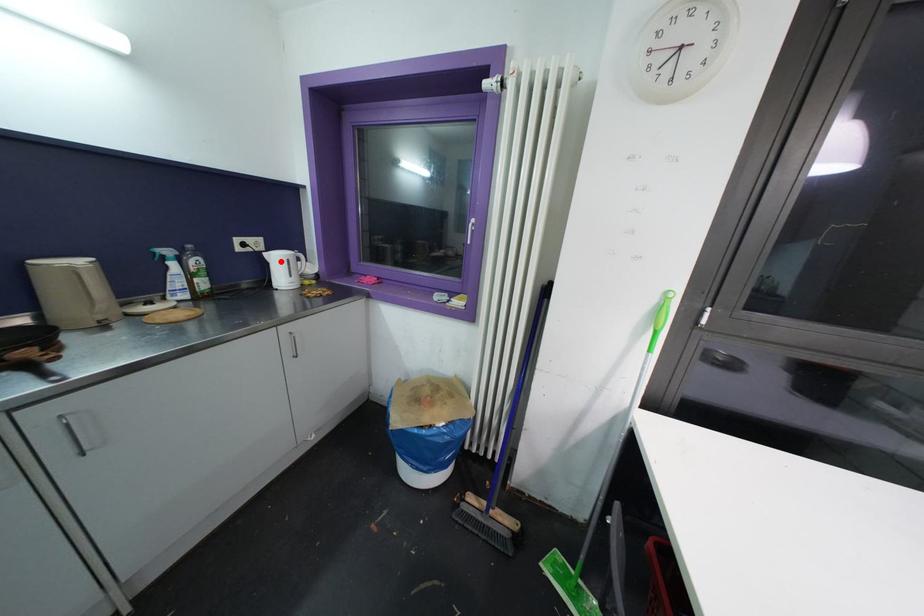
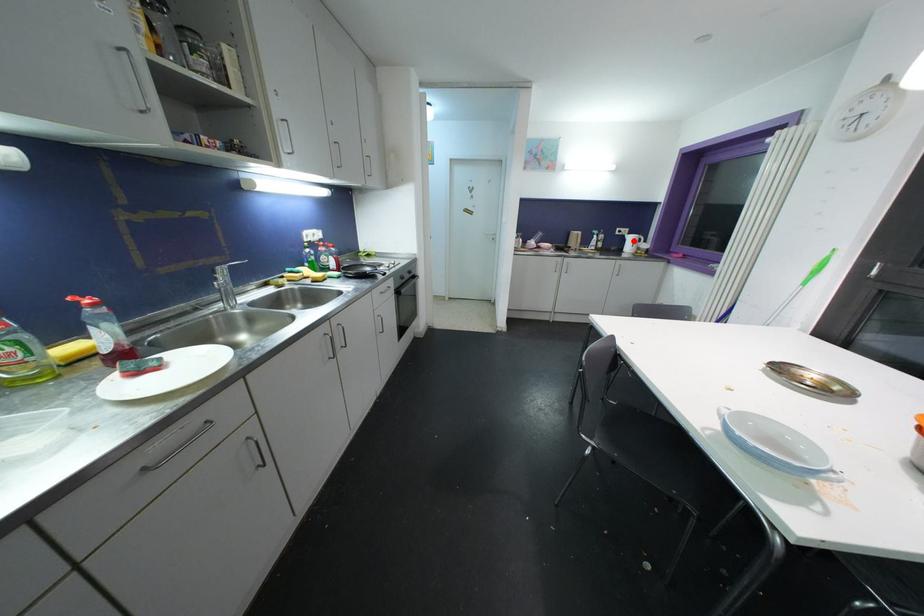
I am providing you with two images of the same scene from different viewpoints. A red point is marked on the first image and another point is marked on the second image. Do the highlighted points in image1 and image2 indicate the same real-world spot?

Yes